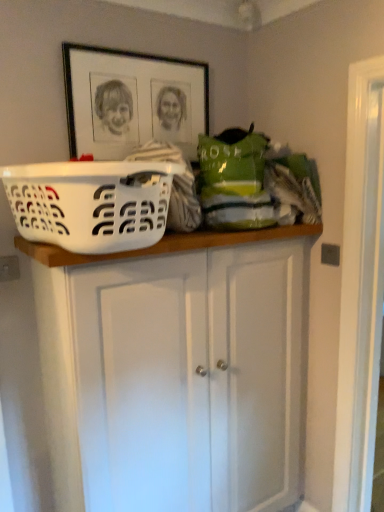
Question: Is white painted wood cabinet at upper center in front of or behind black matte picture frame at upper center in the image?

Choices:
 (A) front
 (B) behind

Answer: (A)

Question: Based on their sizes in the image, would you say white painted wood cabinet at upper center is bigger or smaller than black matte picture frame at upper center?

Choices:
 (A) big
 (B) small

Answer: (A)

Question: Considering the real-world distances, which object is closest to the black matte picture frame at upper center?

Choices:
 (A) white plastic laundry basket at upper center
 (B) white painted wood cabinet at upper center

Answer: (A)

Question: Considering the real-world distances, which object is farthest from the black matte picture frame at upper center?

Choices:
 (A) white plastic laundry basket at upper center
 (B) white painted wood cabinet at upper center

Answer: (B)